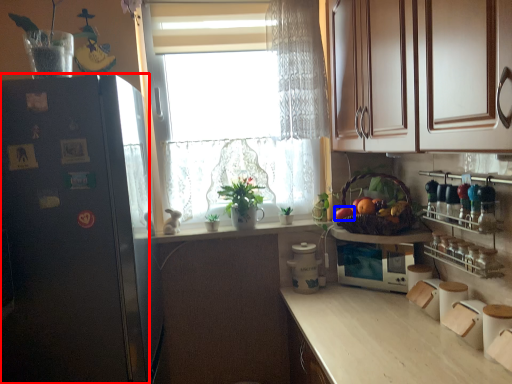
Question: Which of the following is the closest to the observer, cupboard (highlighted by a red box) or fruit (highlighted by a blue box)?

Choices:
 (A) cupboard
 (B) fruit

Answer: (A)